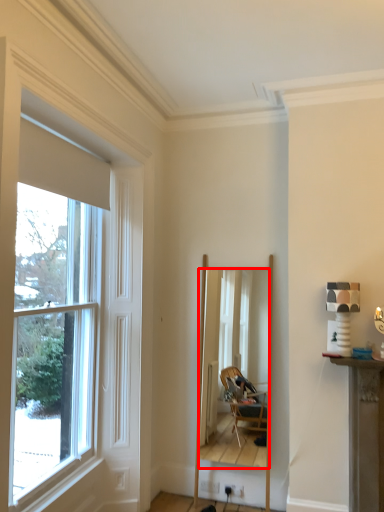
Question: From the image's perspective, what is the correct spatial positioning of mirror (annotated by the red box) in reference to window?

Choices:
 (A) below
 (B) above

Answer: (A)